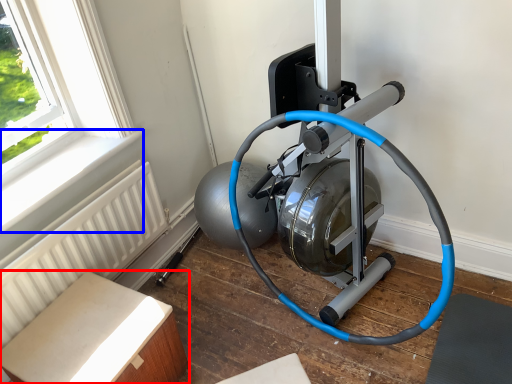
Question: Which of the following is the closest to the observer, furniture (highlighted by a red box) or window sill (highlighted by a blue box)?

Choices:
 (A) furniture
 (B) window sill

Answer: (A)